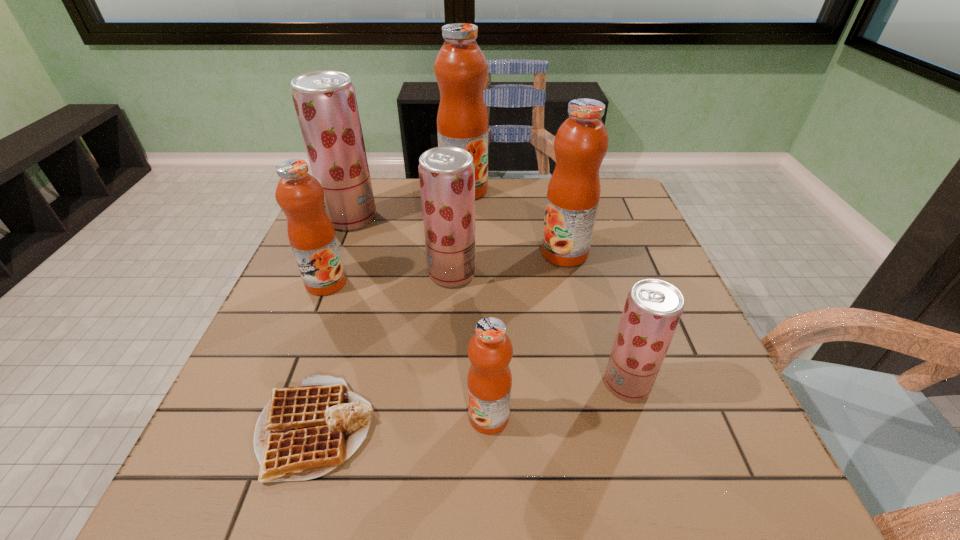
Identify the location of free space between the nearest orange fruit juice and the shortest object. pos(402,422).

The width and height of the screenshot is (960, 540). I want to click on free space between the rightmost orange fruit juice and the smallest strawberry fruit juice, so click(595, 319).

The image size is (960, 540). I want to click on vacant space that's between the second farthest object and the farthest object, so click(x=408, y=204).

You are a GUI agent. You are given a task and a screenshot of the screen. Output one action in this format:
    pyautogui.click(x=<x>, y=<y>)
    Task: Click on the object that is the third closest to the third biggest orange fruit juice
    The width and height of the screenshot is (960, 540).
    Given the screenshot: What is the action you would take?
    pyautogui.click(x=304, y=432)

Select which object appears as the second closest to the rightmost strawberry fruit juice. Please provide its 2D coordinates. Your answer should be formatted as a tuple, i.e. [(x, y)], where the tuple contains the x and y coordinates of a point satisfying the conditions above.

[(581, 142)]

This screenshot has height=540, width=960. Find the location of `fruit juice that is the fourth closest to the second biggest orange fruit juice`. fruit juice that is the fourth closest to the second biggest orange fruit juice is located at coordinates (489, 382).

Point out which fruit juice is positioned as the seventh nearest to the waffle. Please provide its 2D coordinates. Your answer should be formatted as a tuple, i.e. [(x, y)], where the tuple contains the x and y coordinates of a point satisfying the conditions above.

[(460, 67)]

Identify which orange fruit juice is the second nearest to the second biggest strawberry fruit juice. Please provide its 2D coordinates. Your answer should be formatted as a tuple, i.e. [(x, y)], where the tuple contains the x and y coordinates of a point satisfying the conditions above.

[(311, 234)]

This screenshot has height=540, width=960. Identify the location of orange fruit juice that is the third closest to the smallest orange fruit juice. (460, 67).

Point out which strawberry fruit juice is positioned as the nearest to the second strawberry fruit juice from right to left. Please provide its 2D coordinates. Your answer should be formatted as a tuple, i.e. [(x, y)], where the tuple contains the x and y coordinates of a point satisfying the conditions above.

[(325, 102)]